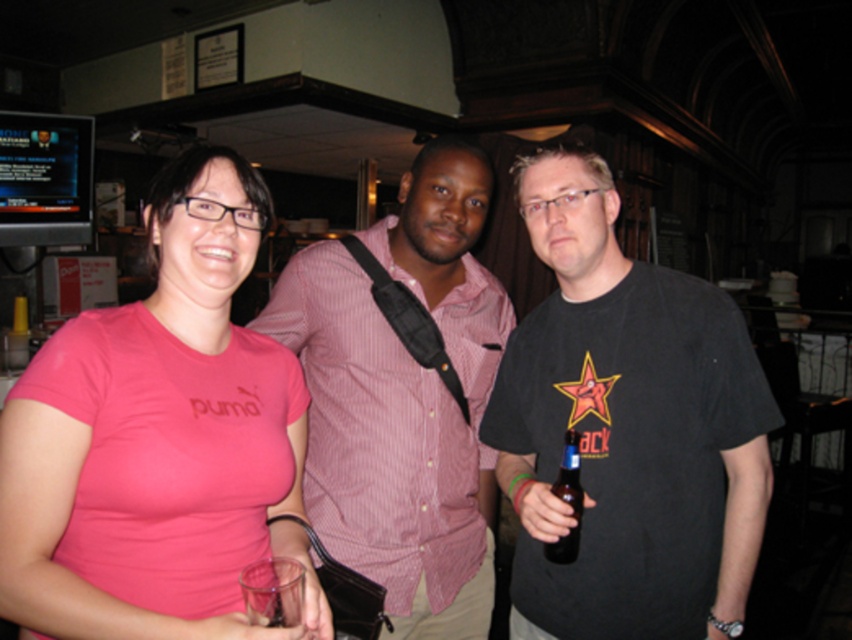
Question: Does transparent plastic cup at lower left have a smaller size compared to brown glass bottle at center?

Choices:
 (A) no
 (B) yes

Answer: (B)

Question: Which point appears farthest from the camera in this image?

Choices:
 (A) (239, 280)
 (B) (557, 480)
 (C) (659, 376)

Answer: (C)

Question: Does pink striped shirt at center have a smaller size compared to pink matte t-shirt at center?

Choices:
 (A) yes
 (B) no

Answer: (B)

Question: Which object is positioned closest to the pink matte t-shirt at center?

Choices:
 (A) black matte t-shirt at center
 (B) transparent plastic cup at lower left
 (C) pink striped shirt at center
 (D) brown glass bottle at center

Answer: (B)

Question: Is pink striped shirt at center positioned at the back of brown glass bottle at center?

Choices:
 (A) no
 (B) yes

Answer: (B)

Question: Which point appears farthest from the camera in this image?

Choices:
 (A) (573, 403)
 (B) (582, 500)
 (C) (181, 296)
 (D) (268, 579)

Answer: (A)